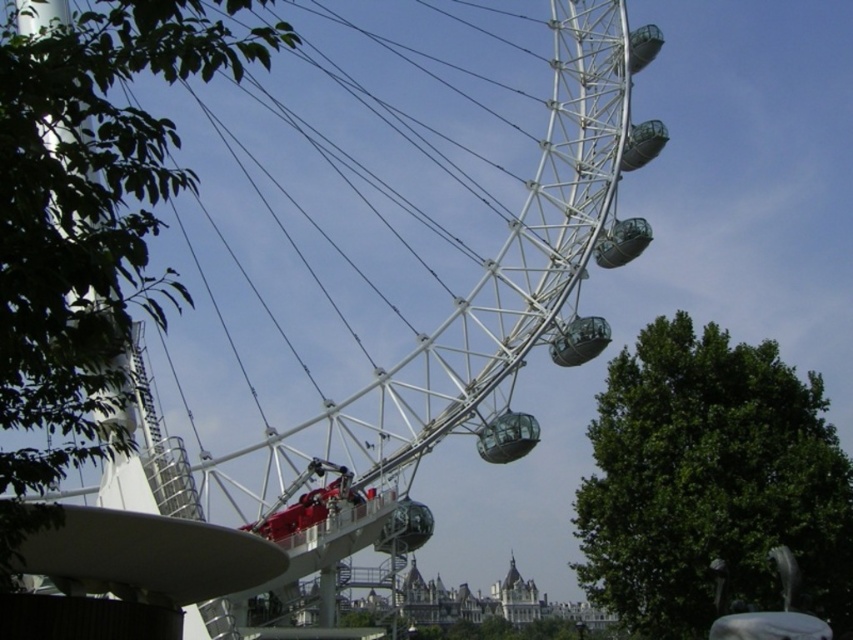
Question: Can you confirm if green leafy tree at left is positioned to the right of transparent glass pod at center?

Choices:
 (A) no
 (B) yes

Answer: (A)

Question: Is green leafy tree at left in front of green leafy tree at right?

Choices:
 (A) yes
 (B) no

Answer: (A)

Question: Which point is closer to the camera?

Choices:
 (A) (115, 364)
 (B) (482, 454)
 (C) (721, 362)
 (D) (527, 189)

Answer: (A)

Question: Is green leafy tree at left smaller than transparent glass pod at center?

Choices:
 (A) no
 (B) yes

Answer: (A)

Question: Which of these objects is positioned farthest from the transparent glass pod at center?

Choices:
 (A) green leafy tree at right
 (B) green leafy tree at left
 (C) white metallic ferris wheel at center

Answer: (B)

Question: Based on their relative distances, which object is nearer to the green leafy tree at left?

Choices:
 (A) transparent glass pod at center
 (B) white metallic ferris wheel at center

Answer: (B)